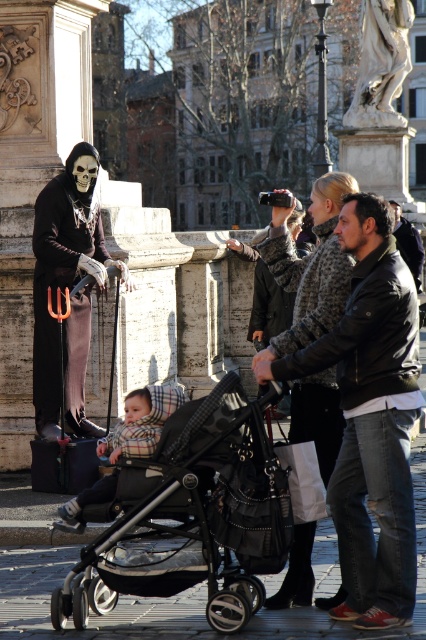
Who is higher up, white marble statue at upper center or plaid fabric baby carriage at center?

white marble statue at upper center is higher up.

Who is positioned more to the left, white marble statue at upper center or plaid fabric baby carriage at center?

Positioned to the left is plaid fabric baby carriage at center.

Who is more forward, (373,118) or (123,436)?

Point (123,436)

At what (x,y) coordinates should I click in order to perform the action: click on white marble statue at upper center. Please return your answer as a coordinate pair (x, y). This screenshot has height=640, width=426. Looking at the image, I should click on (380, 64).

Does matte black stroller at center have a lesser height compared to matte black skeleton at left?

No, matte black stroller at center is not shorter than matte black skeleton at left.

Which of these two, matte black stroller at center or matte black skeleton at left, stands taller?

matte black stroller at center

Does point (367, 570) come closer to viewer compared to point (75, 157)?

That is True.

In order to click on matte black stroller at center in this screenshot , I will do click(x=371, y=417).

Is matte black skeleton at left wider than plaid fabric baby carriage at center?

No, matte black skeleton at left is not wider than plaid fabric baby carriage at center.

This screenshot has height=640, width=426. What do you see at coordinates (63, 266) in the screenshot? I see `matte black skeleton at left` at bounding box center [63, 266].

In order to click on matte black skeleton at left in this screenshot , I will do `click(63, 266)`.